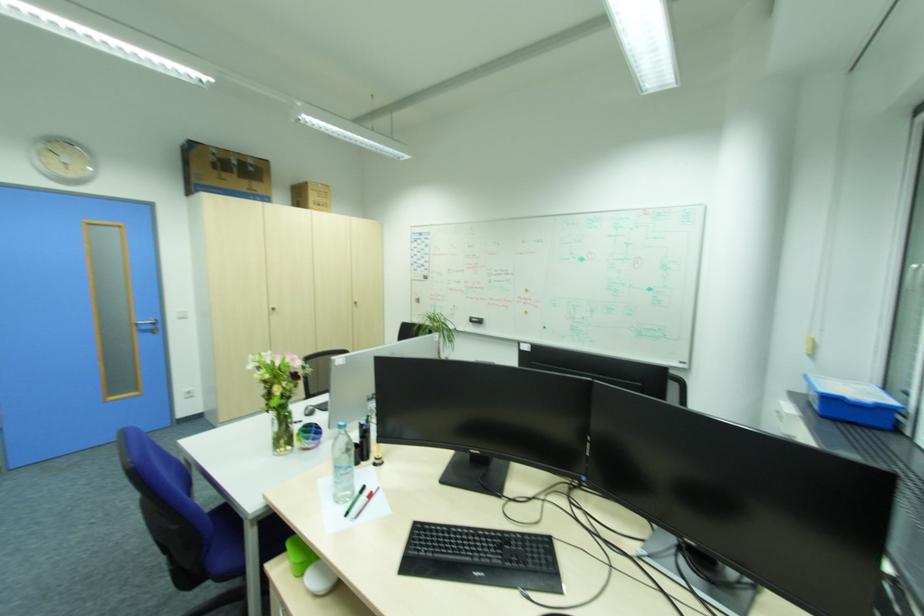
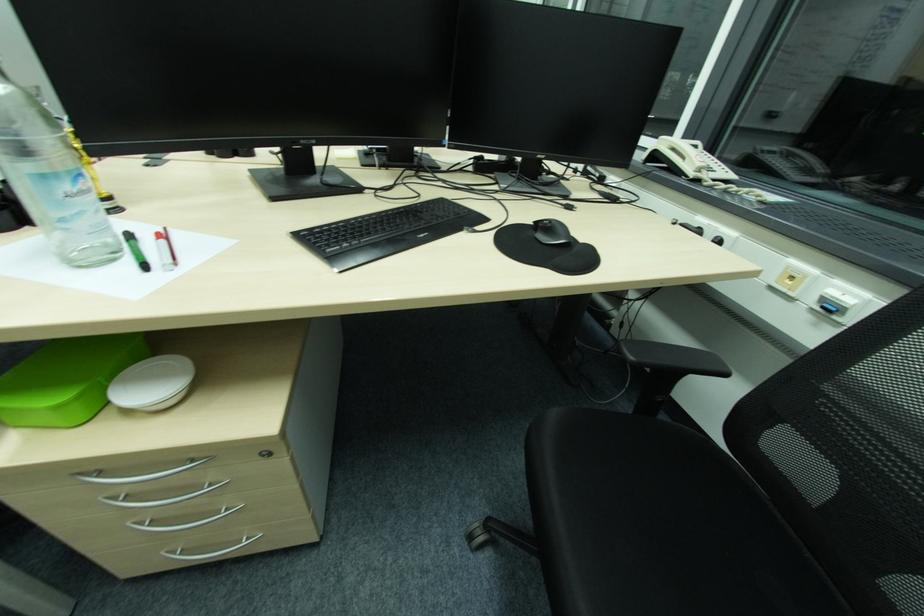
The point at (371, 500) is marked in the first image. Where is the corresponding point in the second image?

(167, 241)